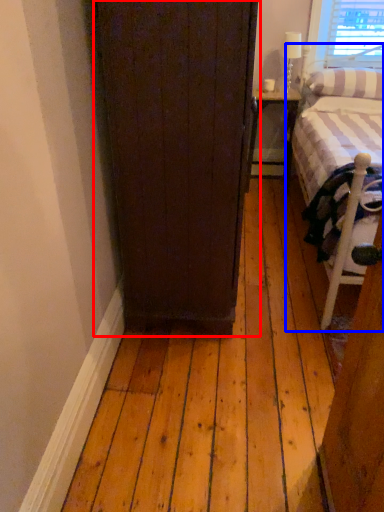
Question: Which of the following is the farthest to the observer, door (highlighted by a red box) or bed (highlighted by a blue box)?

Choices:
 (A) door
 (B) bed

Answer: (B)